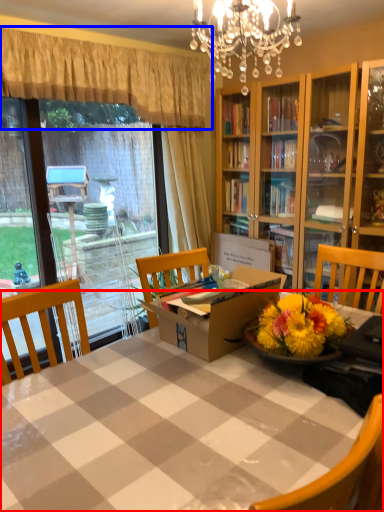
Question: Which object appears farthest to the camera in this image, table (highlighted by a red box) or curtain (highlighted by a blue box)?

Choices:
 (A) table
 (B) curtain

Answer: (B)